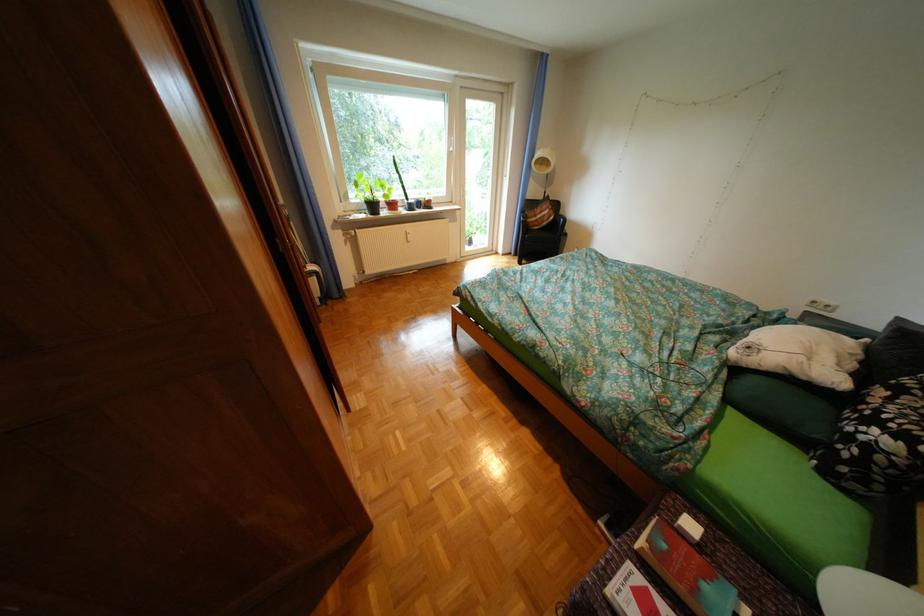
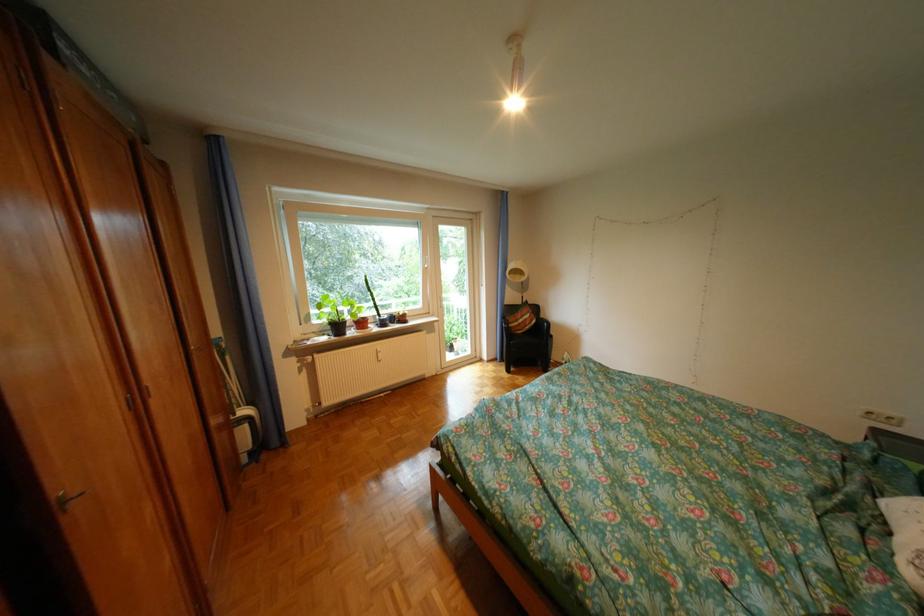
Question: The first image is from the beginning of the video and the second image is from the end. How did the camera likely rotate when shooting the video?

Choices:
 (A) Left
 (B) Right
 (C) Up
 (D) Down

Answer: (C)